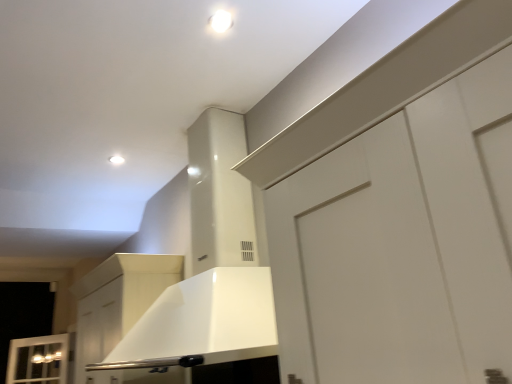
This screenshot has height=384, width=512. What do you see at coordinates (116, 160) in the screenshot? I see `white glossy light fixture at upper center, the 1th lighting positioned from the bottom` at bounding box center [116, 160].

The width and height of the screenshot is (512, 384). Describe the element at coordinates (118, 300) in the screenshot. I see `white matte cabinet at center` at that location.

This screenshot has height=384, width=512. Describe the element at coordinates (221, 21) in the screenshot. I see `white glossy light fixture at upper center, which is counted as the second lighting, starting from the back` at that location.

I want to click on white glossy light fixture at upper center, placed as the 2th lighting when sorted from front to back, so click(x=116, y=160).

Considering the positions of objects white glossy light fixture at upper center, which is the second lighting in right-to-left order, and white glossy light fixture at upper center, the 1th lighting from the top, in the image provided, who is more to the right, white glossy light fixture at upper center, which is the second lighting in right-to-left order, or white glossy light fixture at upper center, the 1th lighting from the top,?

Positioned to the right is white glossy light fixture at upper center, the 1th lighting from the top.

Could you tell me if white glossy light fixture at upper center, the 1th lighting positioned from the bottom, is facing white glossy light fixture at upper center, the 2th lighting when ordered from left to right?

Yes, white glossy light fixture at upper center, the 1th lighting positioned from the bottom, is oriented towards white glossy light fixture at upper center, the 2th lighting when ordered from left to right.

Considering the sizes of objects white glossy light fixture at upper center, the second lighting positioned from the top, and white glossy light fixture at upper center, which is counted as the 1th lighting, starting from the front, in the image provided, who is taller, white glossy light fixture at upper center, the second lighting positioned from the top, or white glossy light fixture at upper center, which is counted as the 1th lighting, starting from the front,?

white glossy light fixture at upper center, which is counted as the 1th lighting, starting from the front, is taller.

The image size is (512, 384). Find the location of `lighting on the right side of white glossy light fixture at upper center, which is the second lighting in right-to-left order`. lighting on the right side of white glossy light fixture at upper center, which is the second lighting in right-to-left order is located at coordinates (221, 21).

Is white glossy light fixture at upper center, acting as the second lighting starting from the bottom, inside or outside of white glossy light fixture at upper center, the 1th lighting from the left?

white glossy light fixture at upper center, acting as the second lighting starting from the bottom, lies outside white glossy light fixture at upper center, the 1th lighting from the left.

From the image's perspective, is white glossy light fixture at upper center, the 2th lighting when ordered from left to right, located above or below white glossy light fixture at upper center, the second lighting positioned from the top?

From the image's perspective, white glossy light fixture at upper center, the 2th lighting when ordered from left to right, appears above white glossy light fixture at upper center, the second lighting positioned from the top.

Consider the image. Is the position of white glossy light fixture at upper center, the 1th lighting from the top, less distant than that of white glossy light fixture at upper center, the 1th lighting from the left?

Yes, white glossy light fixture at upper center, the 1th lighting from the top, is closer to the viewer.

Is white glossy light fixture at upper center, which is counted as the second lighting, starting from the back, aimed at white glossy light fixture at upper center, the 1th lighting from the left?

No, white glossy light fixture at upper center, which is counted as the second lighting, starting from the back, does not turn towards white glossy light fixture at upper center, the 1th lighting from the left.

Based on their sizes in the image, would you say white matte cabinet at center is bigger or smaller than white glossy light fixture at upper center, which appears as the first lighting when viewed from the right?

white matte cabinet at center is bigger than white glossy light fixture at upper center, which appears as the first lighting when viewed from the right.

Between white matte cabinet at center and white glossy light fixture at upper center, the 1th lighting from the top, which one is positioned in front?

Positioned in front is white glossy light fixture at upper center, the 1th lighting from the top.

From the image's perspective, does white matte cabinet at center appear higher than white glossy light fixture at upper center, the 2th lighting when ordered from left to right?

No, from the image's perspective, white matte cabinet at center is not over white glossy light fixture at upper center, the 2th lighting when ordered from left to right.

Is white matte cabinet at center not inside white glossy light fixture at upper center, which is counted as the 1th lighting, starting from the front?

Indeed, white matte cabinet at center is completely outside white glossy light fixture at upper center, which is counted as the 1th lighting, starting from the front.

Is there a large distance between white glossy light fixture at upper center, the 1th lighting from the left, and white matte cabinet at center?

They are positioned close to each other.

Which point is more distant from viewer, (114, 159) or (156, 287)?

The point (114, 159) is more distant.

Locate an element on the screen. cabinetry in front of the white glossy light fixture at upper center, the 1th lighting positioned from the bottom is located at coordinates (118, 300).

Are white glossy light fixture at upper center, the 2th lighting when ordered from left to right, and white matte cabinet at center far apart?

white glossy light fixture at upper center, the 2th lighting when ordered from left to right, is positioned a significant distance from white matte cabinet at center.

Which object is positioned more to the left, white glossy light fixture at upper center, the 1th lighting from the top, or white matte cabinet at center?

white matte cabinet at center is more to the left.

Which is closer, (227, 13) or (105, 290)?

Point (227, 13) is closer to the camera than point (105, 290).

Consider the image. Is white matte cabinet at center bigger or smaller than white glossy light fixture at upper center, the 1th lighting from the left?

white matte cabinet at center is bigger than white glossy light fixture at upper center, the 1th lighting from the left.

Do you think white matte cabinet at center is within white glossy light fixture at upper center, acting as the first lighting starting from the back, or outside of it?

The correct answer is: outside.

Considering the relative sizes of white matte cabinet at center and white glossy light fixture at upper center, the 1th lighting from the left, in the image provided, is white matte cabinet at center wider than white glossy light fixture at upper center, the 1th lighting from the left,?

Yes, white matte cabinet at center is wider than white glossy light fixture at upper center, the 1th lighting from the left.

Find the location of a particular element. The width and height of the screenshot is (512, 384). the 1st lighting above the white matte cabinet at center (from the image's perspective) is located at coordinates (116, 160).

Where is `lighting lying on the right of white glossy light fixture at upper center, placed as the 2th lighting when sorted from front to back`? The image size is (512, 384). lighting lying on the right of white glossy light fixture at upper center, placed as the 2th lighting when sorted from front to back is located at coordinates (221, 21).

In the image, there is a white glossy light fixture at upper center, which is counted as the 1th lighting, starting from the front. Identify the location of lighting below it (from a real-world perspective). pos(116,160).

Estimate the real-world distances between objects in this image. Which object is closer to white matte cabinet at center, white glossy light fixture at upper center, the 1th lighting positioned from the bottom, or white glossy light fixture at upper center, which is counted as the second lighting, starting from the back?

white glossy light fixture at upper center, the 1th lighting positioned from the bottom, is closer to white matte cabinet at center.

Considering their positions, is white glossy light fixture at upper center, the 2th lighting when ordered from left to right, positioned further to white glossy light fixture at upper center, placed as the 2th lighting when sorted from front to back, than white matte cabinet at center?

Among the two, white glossy light fixture at upper center, the 2th lighting when ordered from left to right, is located further to white glossy light fixture at upper center, placed as the 2th lighting when sorted from front to back.

In the scene shown: From the image, which object appears to be nearer to white glossy light fixture at upper center, which is counted as the 1th lighting, starting from the front, white glossy light fixture at upper center, the second lighting positioned from the top, or white matte cabinet at center?

white glossy light fixture at upper center, the second lighting positioned from the top, is positioned closer to the anchor white glossy light fixture at upper center, which is counted as the 1th lighting, starting from the front.

Looking at the image, which one is located further to white glossy light fixture at upper center, acting as the first lighting starting from the back, white matte cabinet at center or white glossy light fixture at upper center, the 1th lighting from the top?

white glossy light fixture at upper center, the 1th lighting from the top, is positioned further to the anchor white glossy light fixture at upper center, acting as the first lighting starting from the back.

Considering their positions, is white matte cabinet at center positioned closer to white glossy light fixture at upper center, acting as the second lighting starting from the bottom, than white glossy light fixture at upper center, the 1th lighting from the left?

white glossy light fixture at upper center, the 1th lighting from the left, lies closer to white glossy light fixture at upper center, acting as the second lighting starting from the bottom, than the other object.

Based on their spatial positions, is white glossy light fixture at upper center, acting as the second lighting starting from the bottom, or white glossy light fixture at upper center, acting as the first lighting starting from the back, further from white matte cabinet at center?

white glossy light fixture at upper center, acting as the second lighting starting from the bottom, is positioned further to the anchor white matte cabinet at center.

I want to click on lighting that lies between white glossy light fixture at upper center, the 1th lighting from the top, and white matte cabinet at center from top to bottom, so click(x=116, y=160).